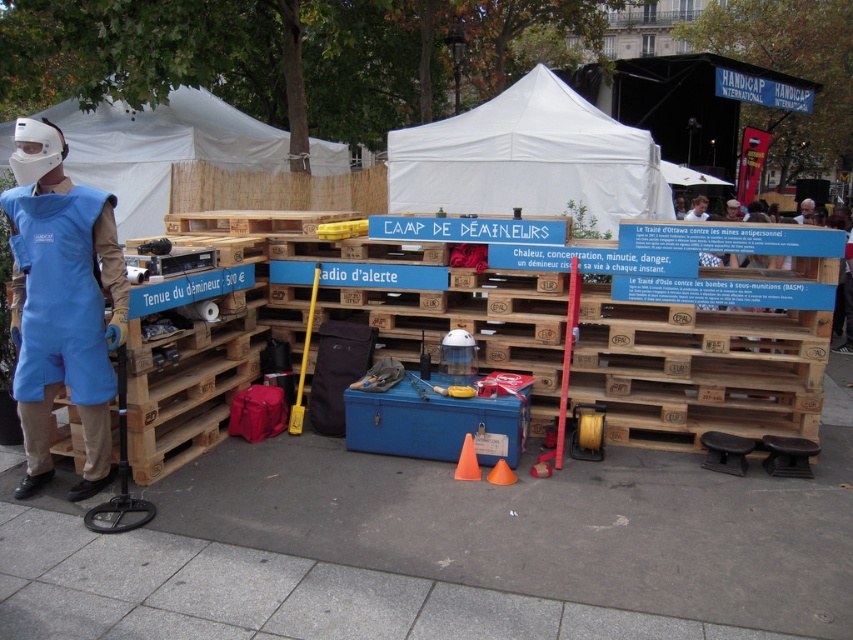
Question: Does blue fabric suit at left have a greater width compared to white fabric tent at center?

Choices:
 (A) no
 (B) yes

Answer: (A)

Question: Does gray concrete pavement at lower center have a larger size compared to blue fabric suit at left?

Choices:
 (A) yes
 (B) no

Answer: (A)

Question: Which of the following is the farthest from the observer?

Choices:
 (A) (456, 148)
 (B) (347, 150)

Answer: (B)

Question: Does gray concrete pavement at lower center appear over white fabric tent at center?

Choices:
 (A) no
 (B) yes

Answer: (A)

Question: Which of the following is the farthest from the observer?

Choices:
 (A) gray concrete pavement at lower center
 (B) white fabric tent at center
 (C) white fabric tent at upper center
 (D) blue fabric suit at left

Answer: (B)

Question: Estimate the real-world distances between objects in this image. Which object is farther from the blue fabric suit at left?

Choices:
 (A) white fabric tent at upper center
 (B) white fabric tent at center

Answer: (B)